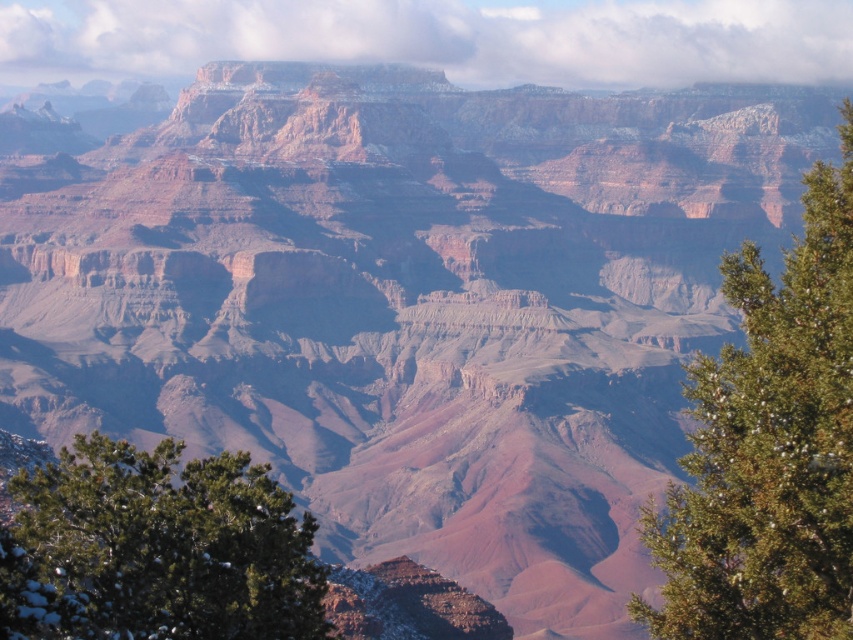
Question: Does green textured pine tree at right have a greater width compared to green textured pine tree at lower left?

Choices:
 (A) no
 (B) yes

Answer: (B)

Question: Does green textured pine tree at right appear under green textured pine tree at lower left?

Choices:
 (A) yes
 (B) no

Answer: (B)

Question: Does green textured pine tree at right have a greater width compared to green textured pine tree at lower left?

Choices:
 (A) no
 (B) yes

Answer: (B)

Question: Which point appears farthest from the camera in this image?

Choices:
 (A) (764, 336)
 (B) (200, 515)

Answer: (B)